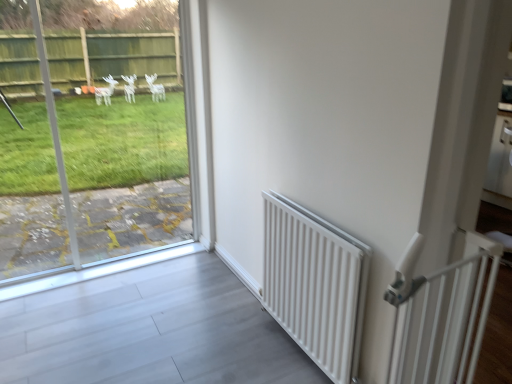
Question: Relative to white matte radiator at right, is transparent glass window at left in front or behind?

Choices:
 (A) front
 (B) behind

Answer: (B)

Question: Choose the correct answer: Is transparent glass window at left inside white matte radiator at right or outside it?

Choices:
 (A) outside
 (B) inside

Answer: (A)

Question: Which object is the closest to the white plastic gate at right?

Choices:
 (A) transparent glass window at left
 (B) white matte radiator at right

Answer: (B)

Question: Which object is positioned farthest from the white plastic gate at right?

Choices:
 (A) transparent glass window at left
 (B) white matte radiator at right

Answer: (A)